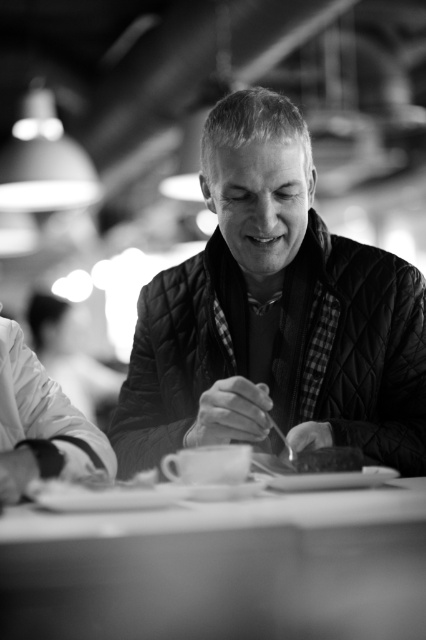
Is point (360, 380) closer to viewer compared to point (143, 518)?

No.

Does quilted fabric jacket at center have a greater width compared to smooth white table at center?

Indeed, quilted fabric jacket at center has a greater width compared to smooth white table at center.

Locate an element on the screen. The height and width of the screenshot is (640, 426). quilted fabric jacket at center is located at coordinates (275, 316).

Where is `quilted fabric jacket at center`? quilted fabric jacket at center is located at coordinates (275, 316).

Is quilted fabric jacket at center to the left of smooth chocolate bar at center from the viewer's perspective?

Yes, quilted fabric jacket at center is to the left of smooth chocolate bar at center.

How distant is quilted fabric jacket at center from smooth chocolate bar at center?

quilted fabric jacket at center and smooth chocolate bar at center are 14.26 inches apart.

Who is more forward, (x=238, y=374) or (x=294, y=452)?

Point (x=294, y=452)

At what (x,y) coordinates should I click in order to perform the action: click on quilted fabric jacket at center. Please return your answer as a coordinate pair (x, y). This screenshot has height=640, width=426. Looking at the image, I should click on coord(275,316).

Does smooth white table at center appear on the left side of smooth chocolate bar at center?

Yes, smooth white table at center is to the left of smooth chocolate bar at center.

Who is shorter, smooth white table at center or smooth chocolate bar at center?

With less height is smooth chocolate bar at center.

Which is in front, point (187, 637) or point (351, 454)?

Point (187, 637)

You are a GUI agent. You are given a task and a screenshot of the screen. Output one action in this format:
    pyautogui.click(x=<x>, y=<y>)
    Task: Click on the smooth white table at center
    
    Given the screenshot: What is the action you would take?
    pyautogui.click(x=221, y=568)